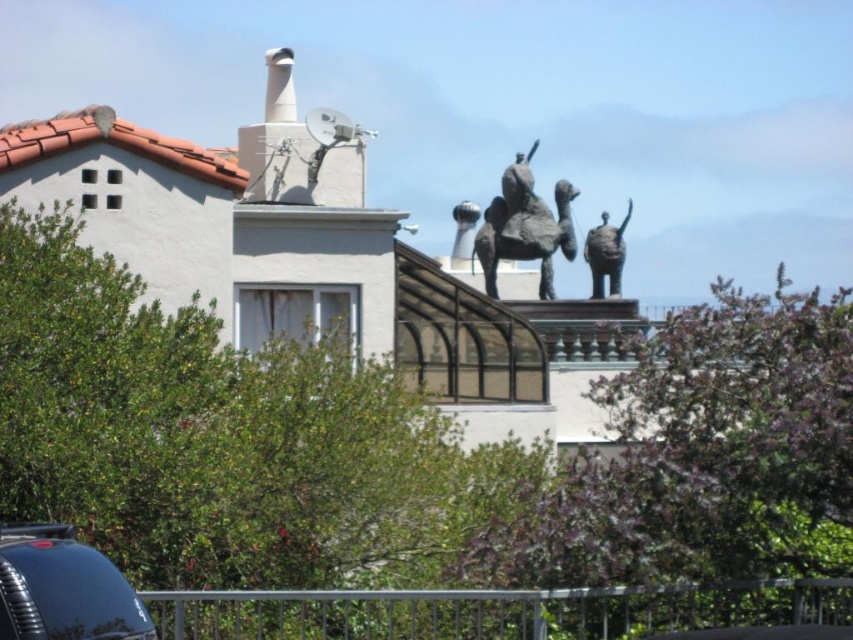
You are an art curator planning to install two bronze statues in a museum courtyard. The statues are labeled as the bronze statue at upper center and bronze statue at upper right. Based on the scene provided, which statue should be placed in a location where height restrictions are in place?

The bronze statue at upper right should be placed in the location with height restrictions because the bronze statue at upper center is taller than it.

You are standing at the entrance of the residential building and want to locate the silver metallic rail at lower center. According to the coordinates given, where would you find the point at position (496,611) on the silver metallic rail at lower center?

The point at position (496,611) is located on the silver metallic rail at lower center.

You are standing in front of the residential building and want to touch both the silver metallic rail at lower center and the bronze statue at upper center. Which object will require you to climb stairs to reach?

The bronze statue at upper center will require climbing stairs because it is located higher up on the rooftop compared to the silver metallic rail at lower center, which is closer to the viewer and likely at ground level.